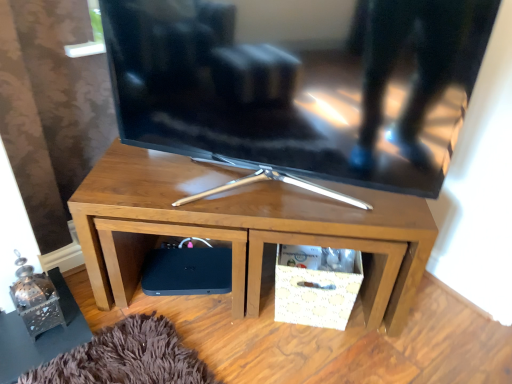
Where is `black matte speaker at lower left`? Image resolution: width=512 pixels, height=384 pixels. black matte speaker at lower left is located at coordinates (187, 271).

Is matte black tv at center to the left or to the right of black matte speaker at lower left in the image?

matte black tv at center is positioned on black matte speaker at lower left's right side.

From the image's perspective, does matte black tv at center appear lower than black matte speaker at lower left?

No, from the image's perspective, matte black tv at center is not below black matte speaker at lower left.

Are matte black tv at center and black matte speaker at lower left far apart?

No, matte black tv at center is in close proximity to black matte speaker at lower left.

Can you tell me how much wooden tv stand at center and matte black tv at center differ in facing direction?

The angular difference between wooden tv stand at center and matte black tv at center is 16.5 degrees.

From the image's perspective, is wooden tv stand at center positioned above or below matte black tv at center?

wooden tv stand at center is below matte black tv at center.

From a real-world perspective, who is located lower, wooden tv stand at center or matte black tv at center?

In real-world perspective, wooden tv stand at center is lower.

Which point is more forward, (x=226, y=172) or (x=134, y=109)?

The point (x=134, y=109) is more forward.

Considering the relative sizes of black matte speaker at lower left and wooden tv stand at center in the image provided, is black matte speaker at lower left bigger than wooden tv stand at center?

Actually, black matte speaker at lower left might be smaller than wooden tv stand at center.

Considering the relative positions of black matte speaker at lower left and wooden tv stand at center in the image provided, is black matte speaker at lower left behind wooden tv stand at center?

Yes, it is.

Does black matte speaker at lower left turn towards wooden tv stand at center?

Yes.

From the picture: Does wooden tv stand at center have a smaller size compared to black matte speaker at lower left?

Actually, wooden tv stand at center might be larger than black matte speaker at lower left.

Would you say black matte speaker at lower left is part of wooden tv stand at center's contents?

That's correct, black matte speaker at lower left is inside wooden tv stand at center.

Could you tell me if wooden tv stand at center is turned towards black matte speaker at lower left?

No, wooden tv stand at center is not turned towards black matte speaker at lower left.

Considering the relative positions of black matte speaker at lower left and matte black tv at center in the image provided, is black matte speaker at lower left to the right of matte black tv at center from the viewer's perspective?

Incorrect, black matte speaker at lower left is not on the right side of matte black tv at center.

Would you say black matte speaker at lower left is a long distance from matte black tv at center?

Actually, black matte speaker at lower left and matte black tv at center are a little close together.

In terms of size, does black matte speaker at lower left appear bigger or smaller than matte black tv at center?

In the image, black matte speaker at lower left appears to be smaller than matte black tv at center.

In the image, is black matte speaker at lower left positioned in front of or behind matte black tv at center?

black matte speaker at lower left is behind matte black tv at center.

Which is closer to the camera, [263,58] or [186,214]?

Point [263,58] appears to be closer to the viewer than point [186,214].

In terms of height, does matte black tv at center look taller or shorter compared to wooden tv stand at center?

matte black tv at center is taller than wooden tv stand at center.

Is matte black tv at center oriented towards wooden tv stand at center?

No.

Would you say wooden tv stand at center is part of matte black tv at center's contents?

No, wooden tv stand at center is not inside matte black tv at center.

Locate an element on the screen. speaker behind the matte black tv at center is located at coordinates (187, 271).

I want to click on desk that appears on the right of matte black tv at center, so click(244, 213).

Which object lies nearer to the anchor point matte black tv at center, wooden tv stand at center or black matte speaker at lower left?

wooden tv stand at center is positioned closer to the anchor matte black tv at center.

When comparing their distances from black matte speaker at lower left, does matte black tv at center or wooden tv stand at center seem further?

matte black tv at center.

When comparing their distances from wooden tv stand at center, does matte black tv at center or black matte speaker at lower left seem further?

Based on the image, black matte speaker at lower left appears to be further to wooden tv stand at center.

From the image, which object appears to be farther from wooden tv stand at center, black matte speaker at lower left or matte black tv at center?

black matte speaker at lower left.

Which object lies nearer to the anchor point black matte speaker at lower left, wooden tv stand at center or matte black tv at center?

wooden tv stand at center is positioned closer to the anchor black matte speaker at lower left.

Which object lies nearer to the anchor point matte black tv at center, black matte speaker at lower left or wooden tv stand at center?

Among the two, wooden tv stand at center is located nearer to matte black tv at center.

You are a GUI agent. You are given a task and a screenshot of the screen. Output one action in this format:
    pyautogui.click(x=<x>, y=<y>)
    Task: Click on the desk between matte black tv at center and black matte speaker at lower left along the z-axis
    
    Given the screenshot: What is the action you would take?
    pyautogui.click(x=244, y=213)